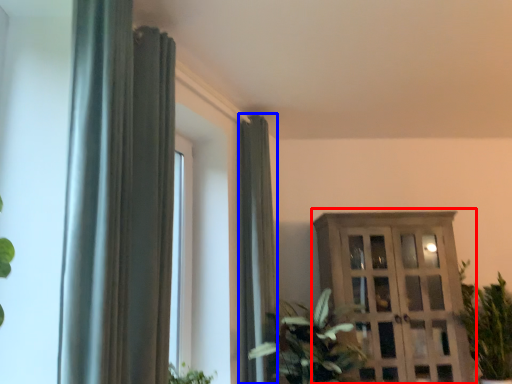
Question: Among these objects, which one is farthest to the camera, dresser (highlighted by a red box) or curtain (highlighted by a blue box)?

Choices:
 (A) dresser
 (B) curtain

Answer: (A)